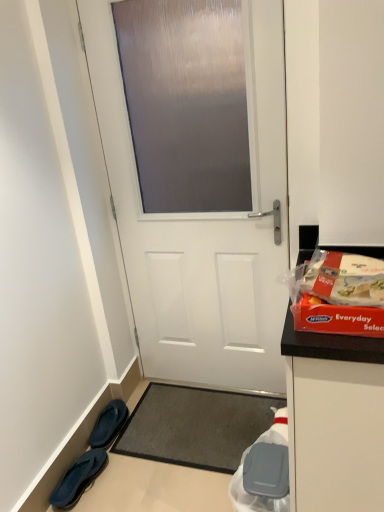
You are a GUI agent. You are given a task and a screenshot of the screen. Output one action in this format:
    pyautogui.click(x=<x>, y=<y>)
    Task: Click on the free spot above dark gray textured mat at center (from a real-world perspective)
    
    Given the screenshot: What is the action you would take?
    pyautogui.click(x=197, y=422)